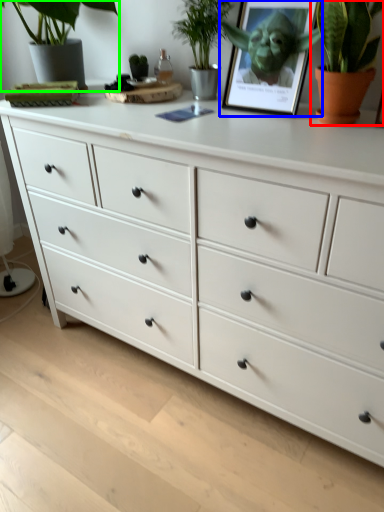
Question: Considering the real-world distances, which object is farthest from houseplant (highlighted by a red box)? picture frame (highlighted by a blue box) or houseplant (highlighted by a green box)?

Choices:
 (A) picture frame
 (B) houseplant

Answer: (B)